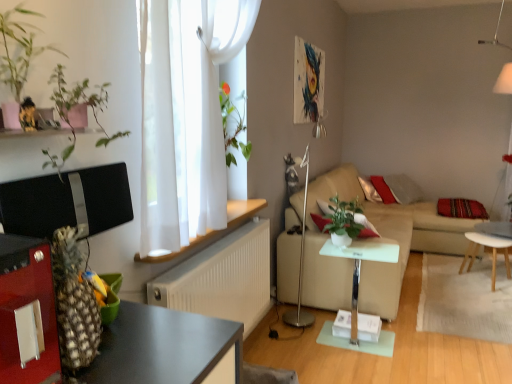
Question: From a real-world perspective, is silver metallic floor lamp at center, the first lamp when ordered from bottom to top, under white textured radiator at center?

Choices:
 (A) yes
 (B) no

Answer: (B)

Question: Can you confirm if silver metallic floor lamp at center, the first lamp when ordered from bottom to top, is smaller than white textured radiator at center?

Choices:
 (A) no
 (B) yes

Answer: (A)

Question: Does silver metallic floor lamp at center, the first lamp when ordered from bottom to top, have a greater width compared to white textured radiator at center?

Choices:
 (A) yes
 (B) no

Answer: (A)

Question: Is silver metallic floor lamp at center, positioned as the second lamp in top-to-bottom order, bigger than white textured radiator at center?

Choices:
 (A) yes
 (B) no

Answer: (A)

Question: Is silver metallic floor lamp at center, the second lamp viewed from the right, to the right of white textured radiator at center from the viewer's perspective?

Choices:
 (A) yes
 (B) no

Answer: (A)

Question: Is point (494, 38) positioned closer to the camera than point (14, 72)?

Choices:
 (A) closer
 (B) farther

Answer: (B)

Question: From the image's perspective, relative to green matte plant at upper left, is white matte lampshade at upper right, arranged as the second lamp when viewed from the left, above or below?

Choices:
 (A) below
 (B) above

Answer: (B)

Question: Considering the relative positions of white matte lampshade at upper right, arranged as the 2th lamp when ordered from the bottom, and green matte plant at upper left in the image provided, is white matte lampshade at upper right, arranged as the 2th lamp when ordered from the bottom, to the left or to the right of green matte plant at upper left?

Choices:
 (A) right
 (B) left

Answer: (A)

Question: Is white matte lampshade at upper right, marked as the 1th lamp in a top-to-bottom arrangement, wider or thinner than green matte plant at upper left?

Choices:
 (A) wide
 (B) thin

Answer: (A)

Question: Is green matte plant at upper left in front of or behind white glossy side table at center, which is the first table from left to right, in the image?

Choices:
 (A) front
 (B) behind

Answer: (A)

Question: In terms of width, does green matte plant at upper left look wider or thinner when compared to white glossy side table at center, which is the first table from left to right?

Choices:
 (A) thin
 (B) wide

Answer: (A)

Question: From the image's perspective, is green matte plant at upper left located above or below white glossy side table at center, which is the 2th table in back-to-front order?

Choices:
 (A) below
 (B) above

Answer: (B)

Question: Is green matte plant at upper left taller or shorter than white glossy side table at center, which is the 2th table in back-to-front order?

Choices:
 (A) tall
 (B) short

Answer: (B)

Question: Considering the positions of green matte plant at upper left and white textured radiator at center in the image, is green matte plant at upper left taller or shorter than white textured radiator at center?

Choices:
 (A) short
 (B) tall

Answer: (A)

Question: From a real-world perspective, relative to white textured radiator at center, is green matte plant at upper left vertically above or below?

Choices:
 (A) above
 (B) below

Answer: (A)